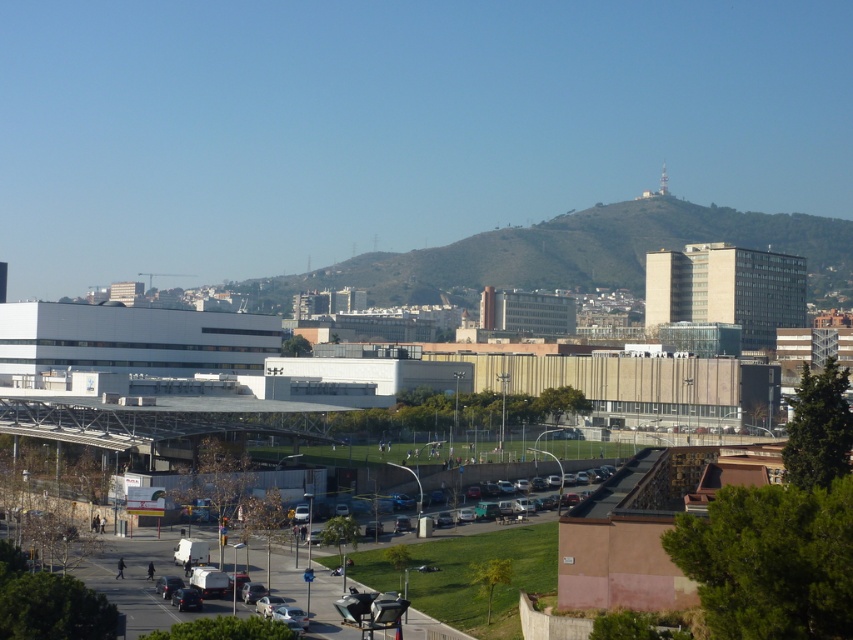
You are a delivery driver who needs to park your truck, which is 6 meters long, between the silver metallic car at lower center and the metallic silver van at lower center. Is there enough space between them for your truck?

The distance between the silver metallic car at lower center and the metallic silver van at lower center is 5.63 meters, which is shorter than the truck length of 6 meters. Therefore, there is not enough space to park the truck between them.

You are a delivery driver who needs to park your vehicle in the parking lot near the beige facade building. You have a silver metallic car at lower center and a metallic silver van at lower center. Which vehicle can fit into a standard parking spot that is 1.8 meters in height?

The silver metallic car at lower center is shorter than the metallic silver van at lower center. Since the parking spot has a height limit of 1.8 meters, the silver metallic car at lower center can fit, but the metallic silver van at lower center might be too tall.

You are standing at the grassy field in the sports complex and see two points marked on the ground. The first point is labeled as point [282,616] and the second is point [178,609]. Which point is closer to you when you are facing the large modern building?

Point [282,616] is in front of point [178,609], so when facing the large modern building, point [282,616] is closer to you.